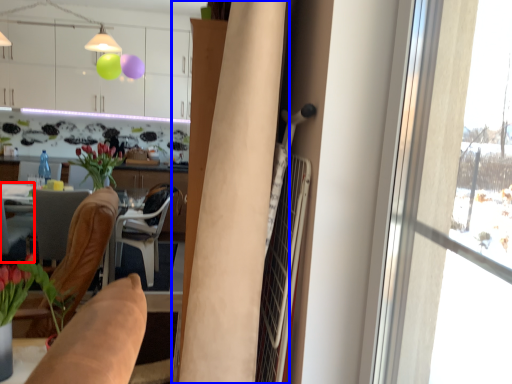
Question: Which object appears closest to the camera in this image, chair (highlighted by a red box) or curtain (highlighted by a blue box)?

Choices:
 (A) chair
 (B) curtain

Answer: (B)